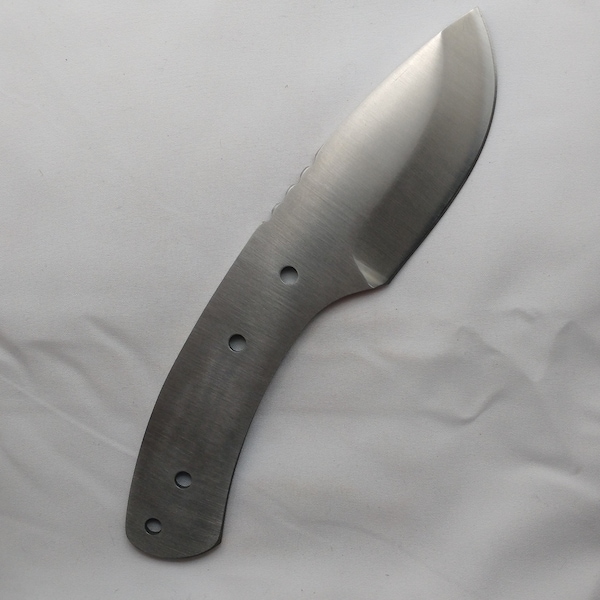
In order to click on bottom of handle in this screenshot , I will do `click(161, 556)`.